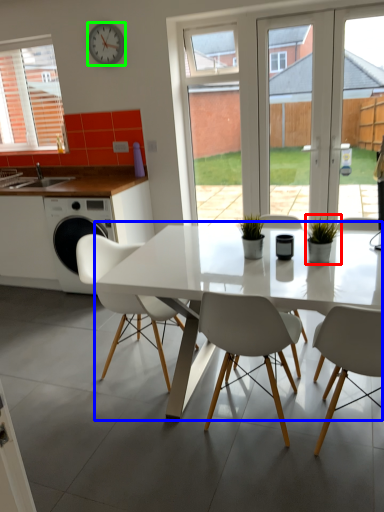
Question: Estimate the real-world distances between objects in this image. Which object is closer to houseplant (highlighted by a red box), kitchen & dining room table (highlighted by a blue box) or clock (highlighted by a green box)?

Choices:
 (A) kitchen & dining room table
 (B) clock

Answer: (A)